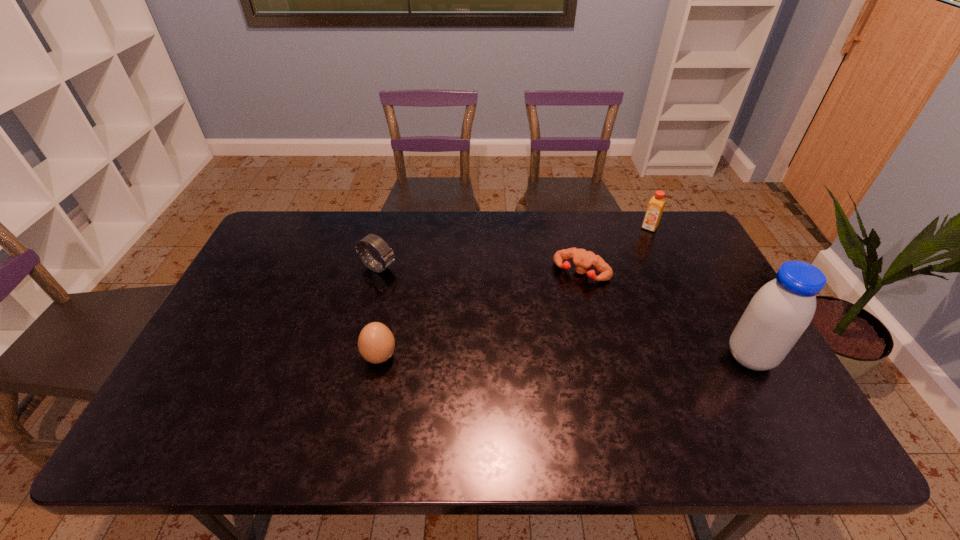
The height and width of the screenshot is (540, 960). I want to click on vacant spot on the desktop that is between the boiled egg and the soya milk and is positioned with the gloves of the shortest object facing forward, so click(x=533, y=357).

Image resolution: width=960 pixels, height=540 pixels. Identify the location of free spot on the desktop that is between the boiled egg and the soya milk and is positioned on the face of the watch. (570, 357).

You are a GUI agent. You are given a task and a screenshot of the screen. Output one action in this format:
    pyautogui.click(x=<x>, y=<y>)
    Task: Click on the free spot on the desktop that is between the boiled egg and the rightmost object and is positioned on the front and back of the orange juice
    The width and height of the screenshot is (960, 540).
    Given the screenshot: What is the action you would take?
    pyautogui.click(x=579, y=357)